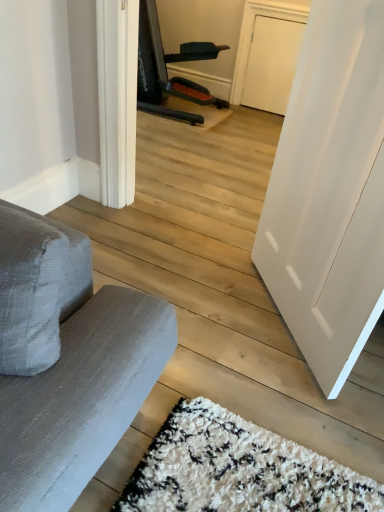
Question: Looking at their shapes, would you say white smooth door at right is wider or thinner than gray fabric armchair at upper left?

Choices:
 (A) thin
 (B) wide

Answer: (A)

Question: Looking at the image, does white smooth door at right seem bigger or smaller compared to gray fabric armchair at upper left?

Choices:
 (A) small
 (B) big

Answer: (A)

Question: From a real-world perspective, is white smooth door at right positioned above or below gray fabric armchair at upper left?

Choices:
 (A) above
 (B) below

Answer: (A)

Question: Is gray fabric armchair at upper left inside or outside of white smooth door at right?

Choices:
 (A) outside
 (B) inside

Answer: (A)

Question: From a real-world perspective, relative to white smooth door at right, is gray fabric armchair at upper left vertically above or below?

Choices:
 (A) below
 (B) above

Answer: (A)

Question: Is gray fabric armchair at upper left taller or shorter than white smooth door at right?

Choices:
 (A) short
 (B) tall

Answer: (A)

Question: Considering the positions of point (150, 105) and point (324, 81), is point (150, 105) closer or farther from the camera than point (324, 81)?

Choices:
 (A) farther
 (B) closer

Answer: (A)